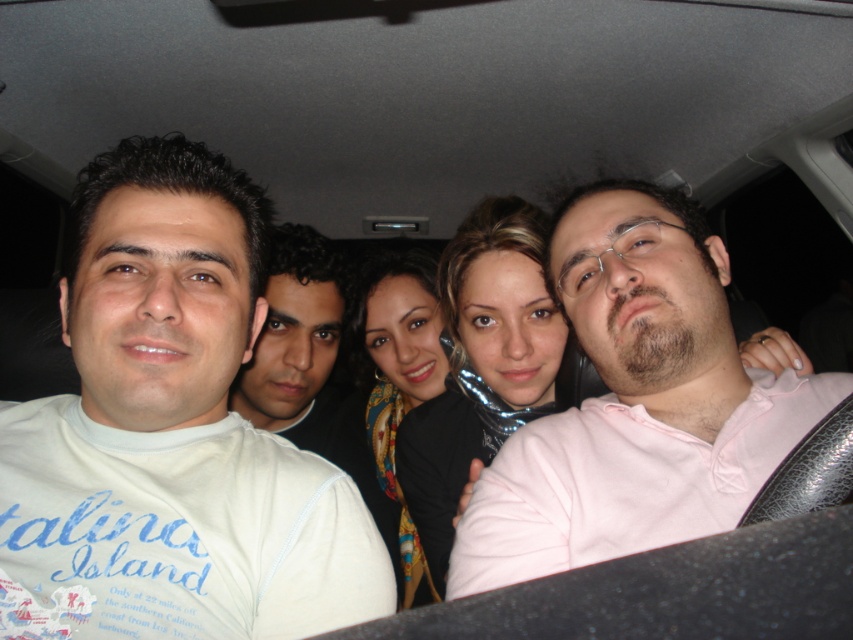
Is pink cotton shirt at center positioned before white cotton shirt at center?

Yes, it is.

Does pink cotton shirt at center have a lesser width compared to white cotton shirt at center?

In fact, pink cotton shirt at center might be wider than white cotton shirt at center.

Between point (766, 426) and point (289, 353), which one is positioned in front?

Point (766, 426) is more forward.

Where is `pink cotton shirt at center`? pink cotton shirt at center is located at coordinates (635, 403).

Based on the photo, can you confirm if white cotton shirt at left is smaller than white cotton shirt at center?

Correct, white cotton shirt at left occupies less space than white cotton shirt at center.

Who is taller, white cotton shirt at left or white cotton shirt at center?

With more height is white cotton shirt at center.

Identify the location of white cotton shirt at left. (171, 433).

At what (x,y) coordinates should I click in order to perform the action: click on white cotton shirt at left. Please return your answer as a coordinate pair (x, y). This screenshot has height=640, width=853. Looking at the image, I should click on (171, 433).

Which of these two, white cotton shirt at left or pink cotton shirt at center, stands taller?

Standing taller between the two is white cotton shirt at left.

Is white cotton shirt at left to the left of pink cotton shirt at center from the viewer's perspective?

Indeed, white cotton shirt at left is positioned on the left side of pink cotton shirt at center.

Find the location of `white cotton shirt at left`. white cotton shirt at left is located at coordinates click(171, 433).